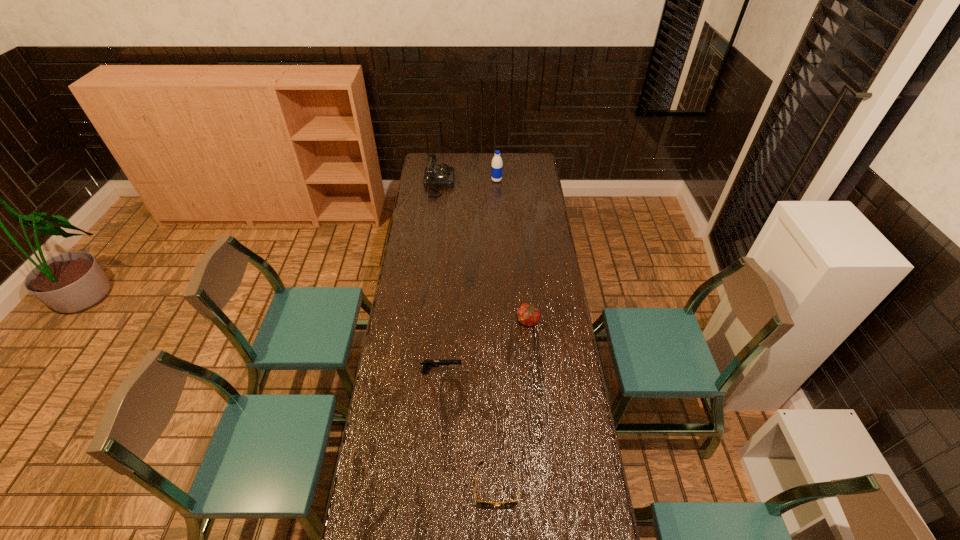
Find the location of a particular element. the tallest object is located at coordinates (496, 168).

Locate an element on the screen. The height and width of the screenshot is (540, 960). the second tallest object is located at coordinates (435, 176).

Where is `the fourth farthest object`? The width and height of the screenshot is (960, 540). the fourth farthest object is located at coordinates (427, 364).

Find the location of `the third farthest object`. the third farthest object is located at coordinates (529, 315).

You are a GUI agent. You are given a task and a screenshot of the screen. Output one action in this format:
    pyautogui.click(x=<x>, y=<y>)
    Task: Click on the rightmost object
    The image size is (960, 540).
    Given the screenshot: What is the action you would take?
    pyautogui.click(x=529, y=315)

At what (x,y) coordinates should I click in order to perform the action: click on the nearest object. Please return your answer as a coordinate pair (x, y). Image resolution: width=960 pixels, height=540 pixels. Looking at the image, I should click on (483, 504).

At what (x,y) coordinates should I click in order to perform the action: click on sunglasses. Please return your answer as a coordinate pair (x, y). The image size is (960, 540). Looking at the image, I should click on (483, 504).

The image size is (960, 540). Identify the location of free region located on the right of the water bottle. (536, 180).

You are a GUI agent. You are given a task and a screenshot of the screen. Output one action in this format:
    pyautogui.click(x=<x>, y=<y>)
    Task: Click on the vacant region located on the dial of the telephone
    The width and height of the screenshot is (960, 540).
    Given the screenshot: What is the action you would take?
    pyautogui.click(x=488, y=184)

You are a GUI agent. You are given a task and a screenshot of the screen. Output one action in this format:
    pyautogui.click(x=<x>, y=<y>)
    Task: Click on the free spot located at the aiming end of the gun
    The image size is (960, 540).
    Given the screenshot: What is the action you would take?
    pyautogui.click(x=551, y=372)